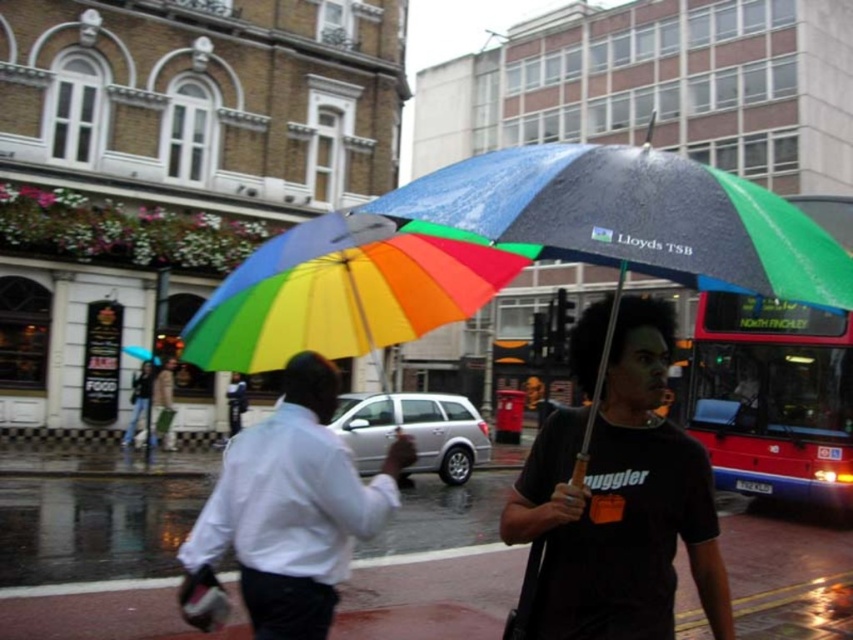
You are a pedestrian standing on the rainy street. You see the rainbow fabric umbrella at center and the white shirt at center. Which object is positioned to the right?

The rainbow fabric umbrella at center is to the right of the white shirt at center.

Based on the scene description, where is the shiny asphalt pavement at lower center located in terms of its 2D coordinates?

The shiny asphalt pavement at lower center is located at the 2D coordinates of point (x=434, y=568).

You are standing on the rainy street and see the rainbow fabric umbrella at center and the red metallic bus at right. Which object appears larger in the scene?

The rainbow fabric umbrella at center appears larger than the red metallic bus at right in the scene.